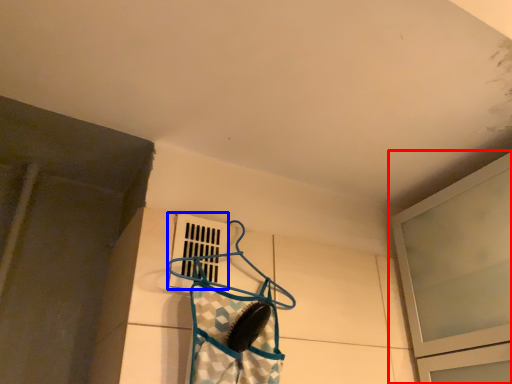
Question: Which of the following is the farthest to the observer, window (highlighted by a red box) or window (highlighted by a blue box)?

Choices:
 (A) window
 (B) window

Answer: (B)